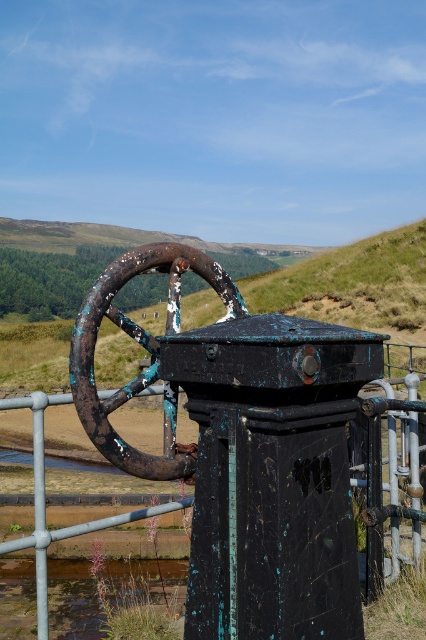
You are standing in front of the valve mechanism and see two points marked on the ground. The first point is at coordinate point (135,332) and the second is at point (40,456). If you want to move from the first point to the second point, which direction should you face to ensure you are moving towards the second point?

To move from point (135,332) to point (40,456), you should face downward and to the right since point (40,456) is located below and to the right of point (135,332).

You are a maintenance worker standing at the origin point of the coordinate system. You need to locate the rusty metal wheel at center. What are its coordinates?

The rusty metal wheel at center is located at coordinates point (144, 348).